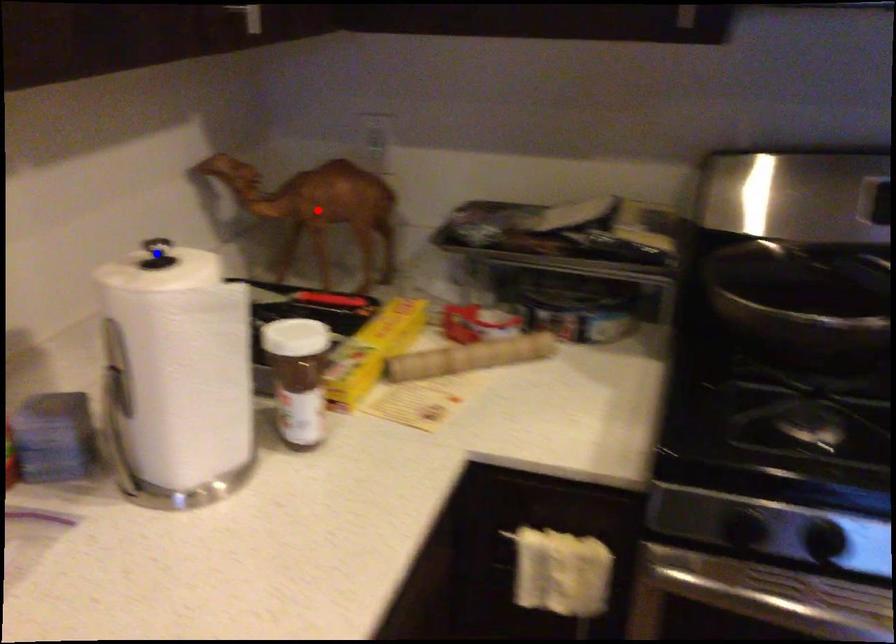
Question: Which of the two points in the image is closer to the camera?

Choices:
 (A) Blue point is closer.
 (B) Red point is closer.

Answer: (A)